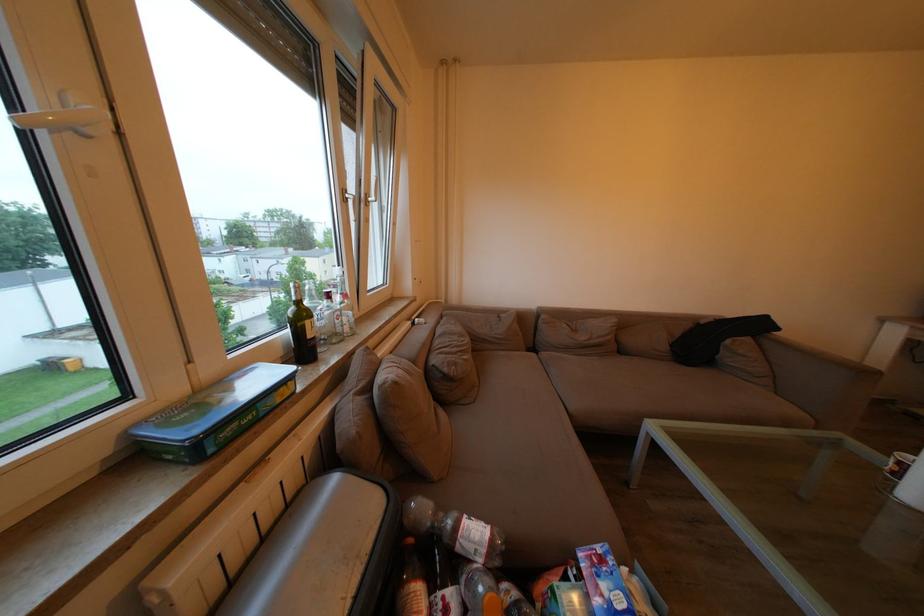
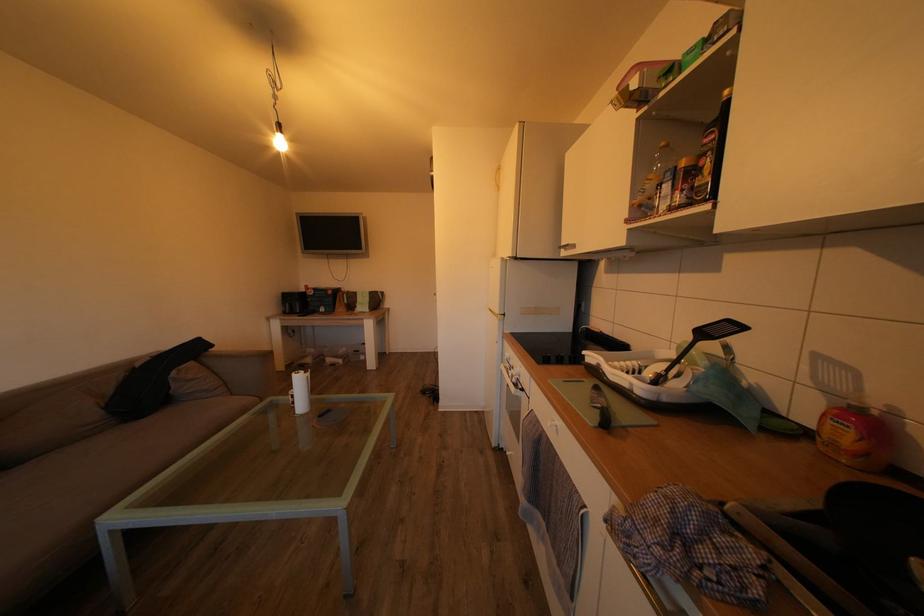
Question: The camera is either moving clockwise (left) or counter-clockwise (right) around the object. The first image is from the beginning of the video and the second image is from the end. Is the camera moving left or right when shooting the video?

Choices:
 (A) Left
 (B) Right

Answer: (A)